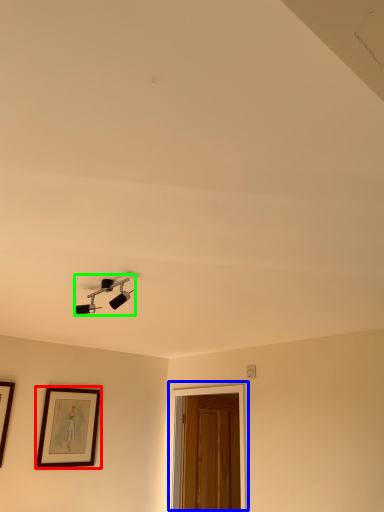
Question: Estimate the real-world distances between objects in this image. Which object is closer to picture frame (highlighted by a red box), glass door (highlighted by a blue box) or lamp (highlighted by a green box)?

Choices:
 (A) glass door
 (B) lamp

Answer: (A)